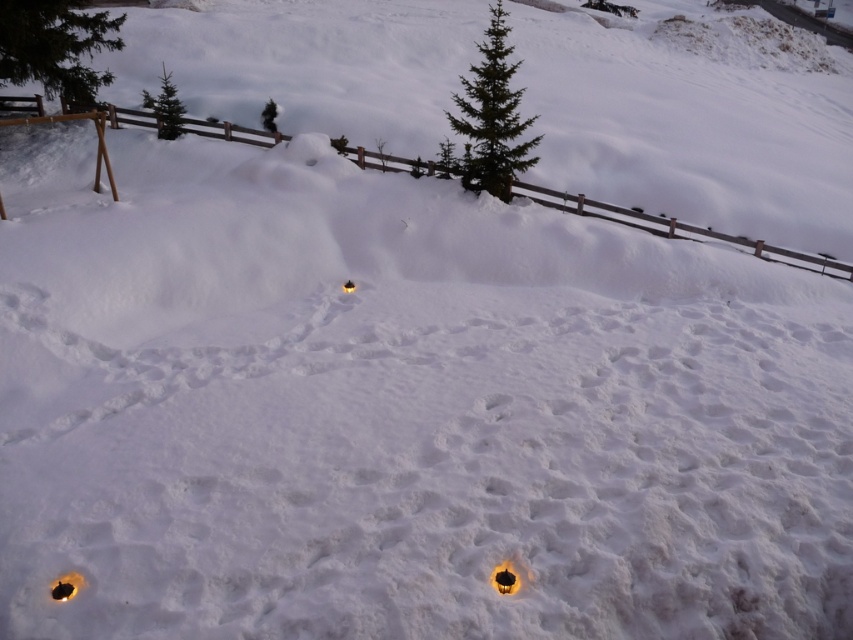
Question: Can you confirm if green textured pine tree at upper left is bigger than green matte tree at upper center?

Choices:
 (A) yes
 (B) no

Answer: (B)

Question: Considering the real-world distances, which object is farthest from the green matte tree at upper left?

Choices:
 (A) brown wooden fence at upper center
 (B) green needle-like tree at upper center
 (C) green matte tree at upper center

Answer: (B)

Question: Can you confirm if brown wooden fence at upper center is positioned to the right of green matte tree at upper left?

Choices:
 (A) yes
 (B) no

Answer: (A)

Question: Is green needle-like tree at upper center positioned at the back of green matte tree at upper left?

Choices:
 (A) yes
 (B) no

Answer: (B)

Question: Which point is closer to the camera?

Choices:
 (A) green matte tree at upper left
 (B) brown wooden fence at upper center
 (C) green needle-like tree at upper center
 (D) green matte tree at upper center

Answer: (B)

Question: Which of these objects is positioned closest to the brown wooden fence at upper center?

Choices:
 (A) green textured pine tree at upper left
 (B) green matte tree at upper center
 (C) green matte tree at upper left

Answer: (B)